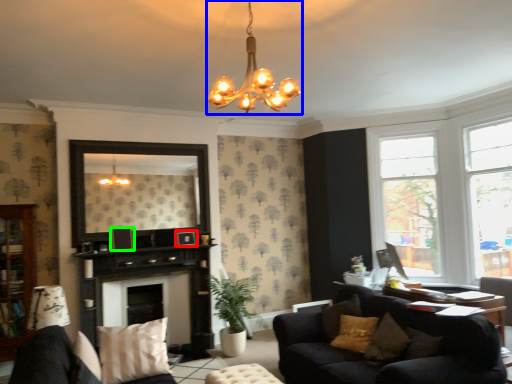
Question: Which object is positioned farthest from picture frame (highlighted by a red box)? Select from lamp (highlighted by a blue box) and picture frame (highlighted by a green box).

Choices:
 (A) lamp
 (B) picture frame

Answer: (A)